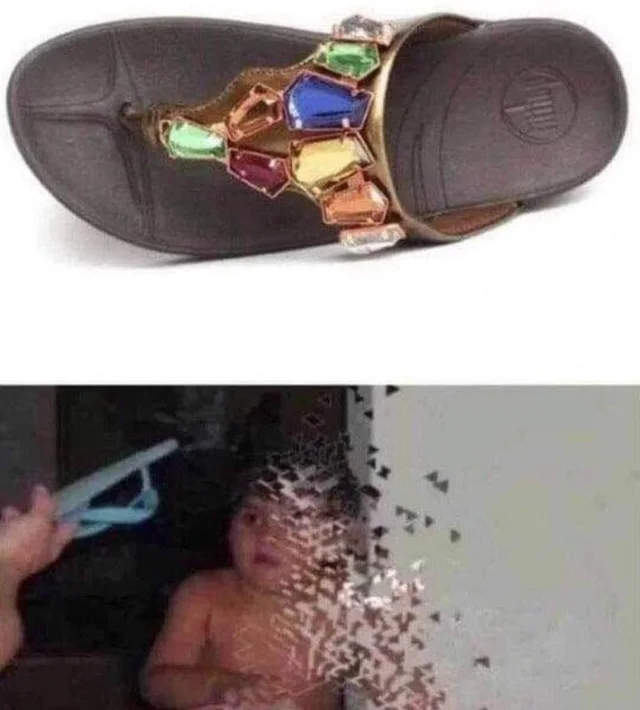
Find the location of a particular element. frames is located at coordinates (340, 151), (328, 530).